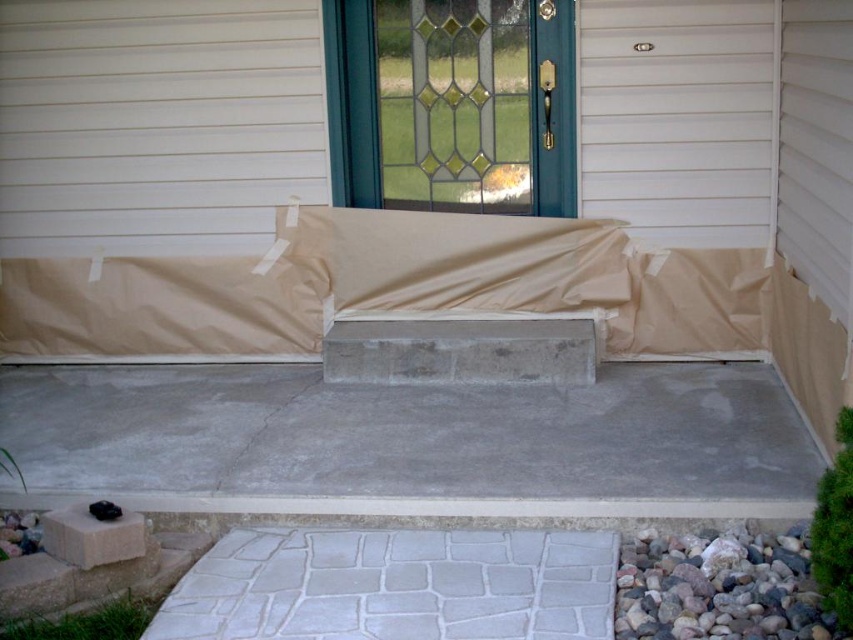
You are standing on the porch of the house and want to place a small potted plant. The coordinates given are for a spot on the porch floor. Is the spot at point (x=395, y=586) on the porch floor suitable for placing the plant?

The point (x=395, y=586) corresponds to the gray stone like at lower center, which is part of the porch floor. Since the porch floor is made of concrete and freshly smoothed out, it should be suitable for placing the plant.